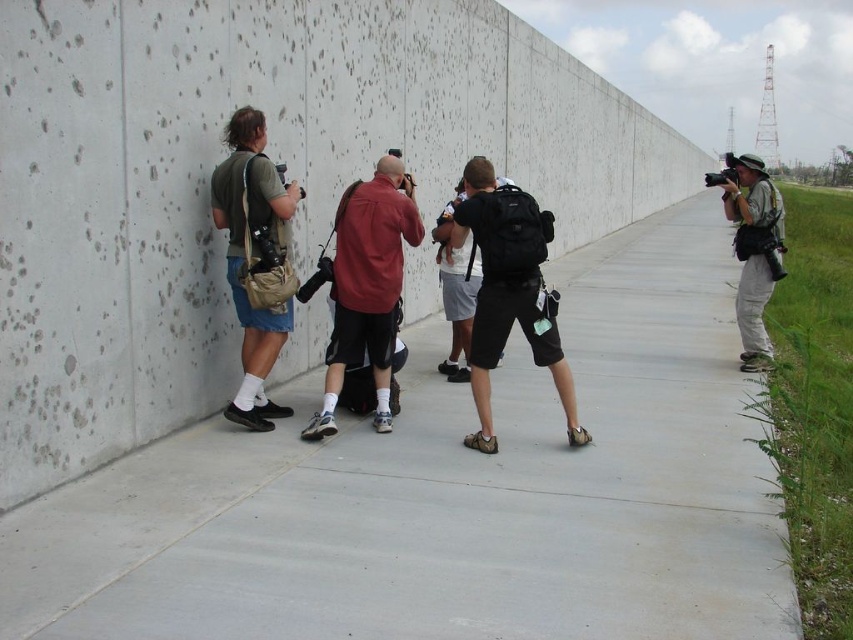
Who is higher up, gray concrete wall at center or khaki fabric shirt at right?

gray concrete wall at center is higher up.

Is gray concrete wall at center further to the viewer compared to khaki fabric shirt at right?

No.

Which is in front, point (379, 88) or point (756, 179)?

Point (756, 179)

I want to click on gray concrete wall at center, so click(273, 160).

Can you confirm if matte khaki shorts at left is taller than khaki fabric shirt at right?

Incorrect, matte khaki shorts at left's height is not larger of khaki fabric shirt at right's.

Who is taller, matte khaki shorts at left or khaki fabric shirt at right?

khaki fabric shirt at right

Which is behind, point (265, 422) or point (735, 241)?

The point (735, 241) is behind.

The height and width of the screenshot is (640, 853). I want to click on matte khaki shorts at left, so click(254, 259).

How distant is gray concrete pavement at center from gray concrete wall at center?

gray concrete pavement at center is 3.54 meters from gray concrete wall at center.

Who is positioned more to the left, gray concrete pavement at center or gray concrete wall at center?

gray concrete pavement at center

In order to click on gray concrete pavement at center in this screenshot , I will do `click(451, 493)`.

What are the coordinates of `gray concrete pavement at center` in the screenshot? It's located at (451, 493).